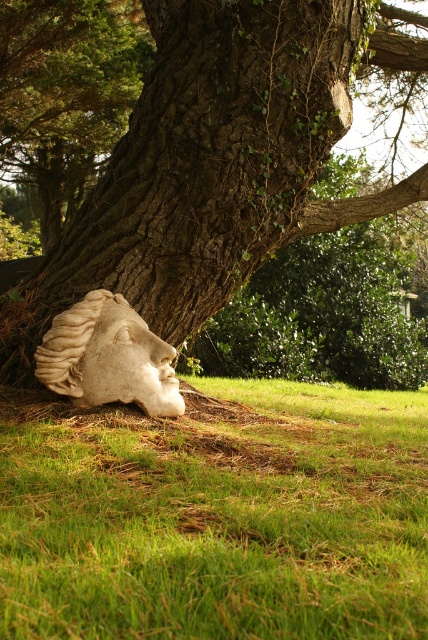
Question: Is green grass at lower center to the right of white stone head at lower left from the viewer's perspective?

Choices:
 (A) yes
 (B) no

Answer: (A)

Question: Which is farther from the dark brown textured bark at center?

Choices:
 (A) green grass at lower center
 (B) white stone head at lower left

Answer: (A)

Question: Which point is farther to the camera?

Choices:
 (A) (95, 262)
 (B) (160, 509)
 (C) (152, 333)

Answer: (A)

Question: Does green grass at lower center appear under white stone head at lower left?

Choices:
 (A) no
 (B) yes

Answer: (B)

Question: Among these points, which one is nearest to the camera?

Choices:
 (A) coord(53,550)
 (B) coord(109,401)

Answer: (A)

Question: Can you confirm if dark brown textured bark at center is smaller than white stone head at lower left?

Choices:
 (A) yes
 (B) no

Answer: (B)